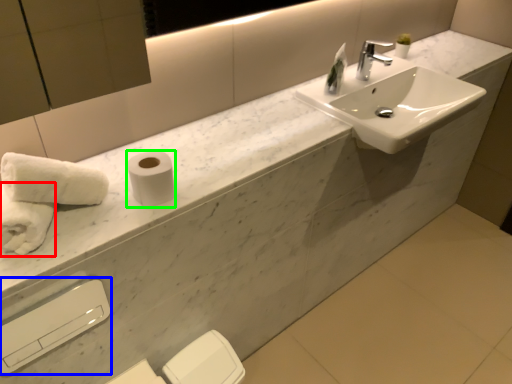
Question: Estimate the real-world distances between objects in this image. Which object is closer to bath towel (highlighted by a red box), hand dryer (highlighted by a blue box) or toilet paper (highlighted by a green box)?

Choices:
 (A) hand dryer
 (B) toilet paper

Answer: (B)